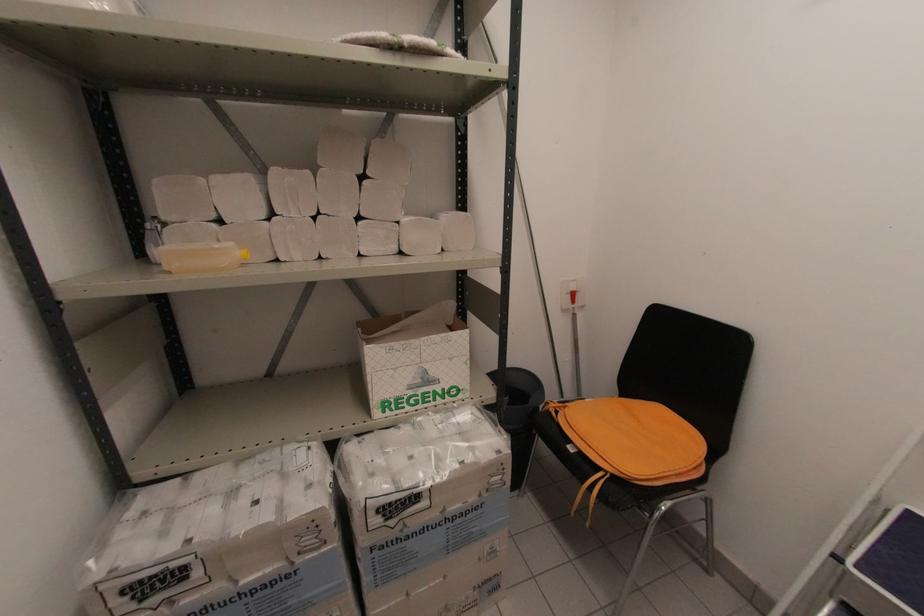
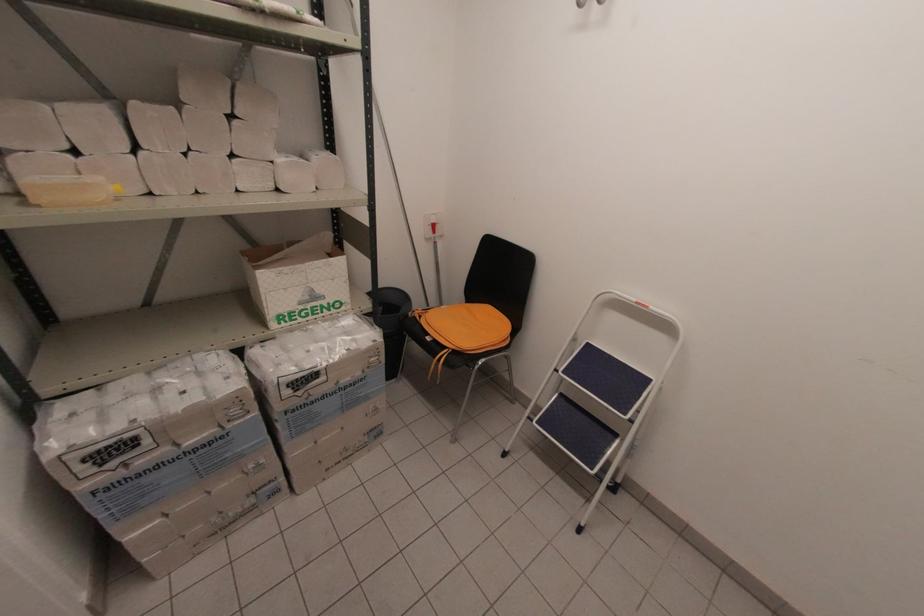
Locate, in the second image, the point that corresponds to point (242, 254) in the first image.

(116, 188)